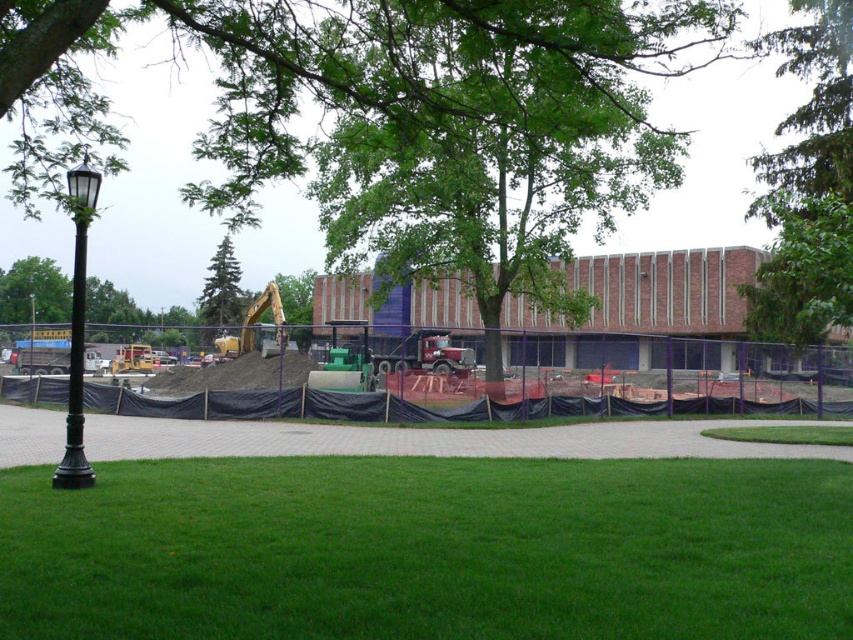
Question: Considering the real-world distances, which object is closest to the green leafy tree at left?

Choices:
 (A) black polished lamp post at left
 (B) black asphalt construction site at center
 (C) green leafy tree at center
 (D) yellow-green metallic excavator at center-left

Answer: (C)

Question: Which of the following is the farthest from the observer?

Choices:
 (A) (36, 278)
 (B) (775, 131)
 (C) (218, 344)
 (D) (401, 397)

Answer: (A)

Question: Based on their relative distances, which object is farther from the green textured pine tree at upper left?

Choices:
 (A) black asphalt construction site at center
 (B) green grass at lower center

Answer: (B)

Question: Does black polished lamp post at left come behind green leafy tree at center?

Choices:
 (A) no
 (B) yes

Answer: (A)

Question: Is green leafy tree at left below yellow-green metallic excavator at center-left?

Choices:
 (A) yes
 (B) no

Answer: (B)

Question: In this image, where is green leafy tree at upper center located relative to green leafy tree at center?

Choices:
 (A) above
 (B) below

Answer: (A)